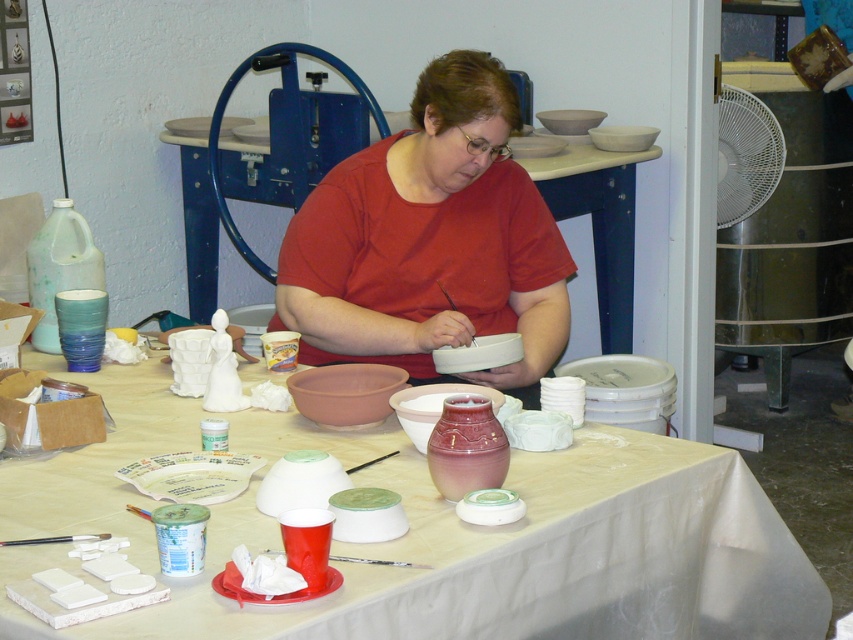
Does white matte table at center come behind matte pink ceramic vase at center?

No, it is in front of matte pink ceramic vase at center.

Between white matte table at center and matte pink ceramic vase at center, which one has more height?

With more height is white matte table at center.

At what (x,y) coordinates should I click in order to perform the action: click on white matte table at center. Please return your answer as a coordinate pair (x, y). This screenshot has height=640, width=853. Looking at the image, I should click on (436, 536).

Which of these two, matte pink ceramic vase at center or matte blue bowl at left, stands taller?

With more height is matte blue bowl at left.

Who is more distant from viewer, (453, 456) or (61, 346)?

Point (61, 346)

Find the location of `matte pink ceramic vase at center`. matte pink ceramic vase at center is located at coordinates (466, 448).

Between white matte table at center and matte blue bowl at left, which one appears on the right side from the viewer's perspective?

white matte table at center is more to the right.

Can you confirm if white matte table at center is positioned below matte blue bowl at left?

Yes.

Which is behind, point (434, 502) or point (57, 323)?

The point (57, 323) is behind.

Identify the location of white matte table at center. (436, 536).